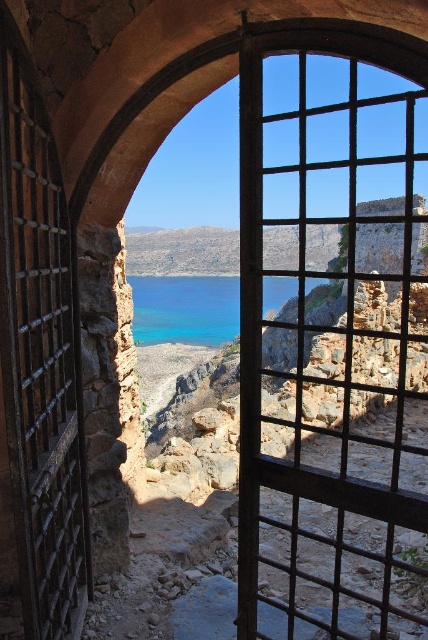
In the scene shown: Can you confirm if metallic grid window at center is smaller than blue crystal water at center?

Correct, metallic grid window at center occupies less space than blue crystal water at center.

Does metallic grid window at center have a lesser width compared to blue crystal water at center?

Yes, metallic grid window at center is thinner than blue crystal water at center.

At what (x,y) coordinates should I click in order to perform the action: click on metallic grid window at center. Please return your answer as a coordinate pair (x, y). This screenshot has width=428, height=640. Looking at the image, I should click on (329, 365).